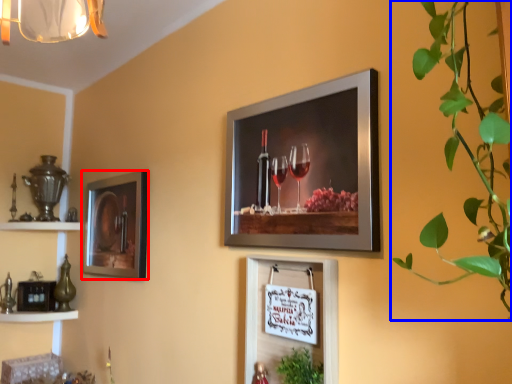
Question: Which of the following is the closest to the observer, picture frame (highlighted by a red box) or houseplant (highlighted by a blue box)?

Choices:
 (A) picture frame
 (B) houseplant

Answer: (B)